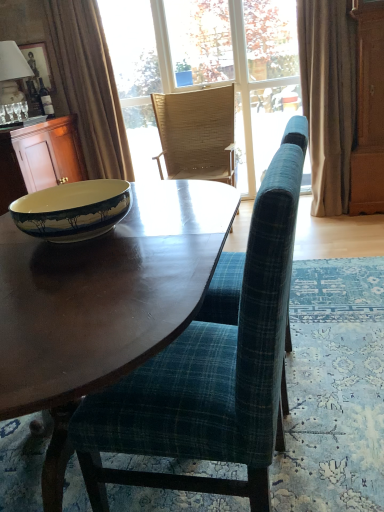
Locate an element on the screen. spots to the right of plaid fabric chair at center, which ranks as the second chair in back-to-front order is located at coordinates (342, 436).